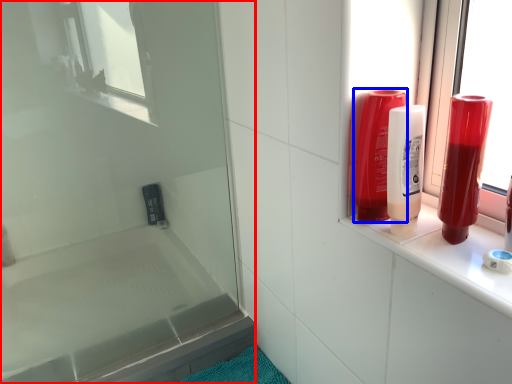
Question: Which of the following is the closest to the observer, screen door (highlighted by a red box) or mouthwash (highlighted by a blue box)?

Choices:
 (A) screen door
 (B) mouthwash

Answer: (B)